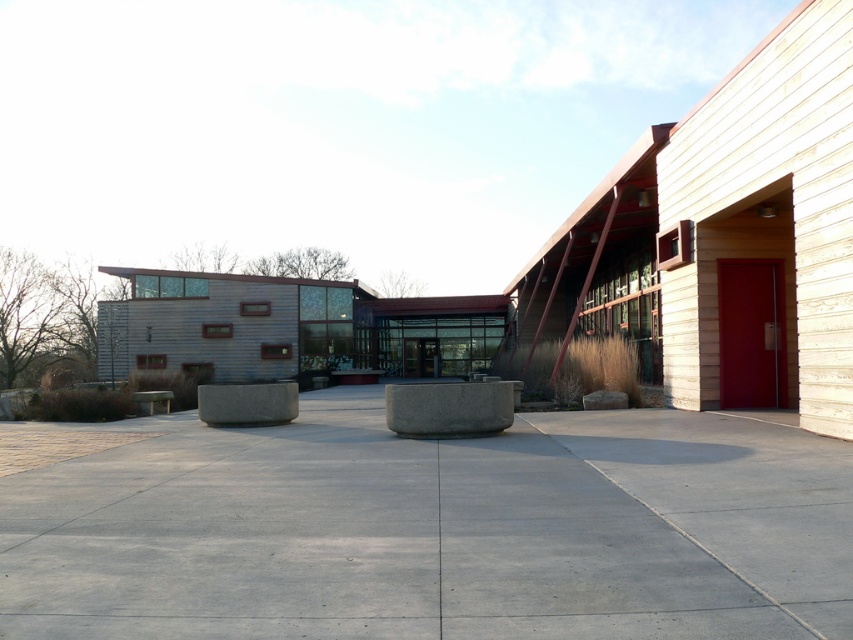
Question: In this image, where is gray concrete pavement at center located relative to gray concrete planter at center?

Choices:
 (A) right
 (B) left

Answer: (B)

Question: Based on their relative distances, which object is farther from the gray concrete at center?

Choices:
 (A) gray concrete planter at center
 (B) gray concrete pavement at center

Answer: (A)

Question: Is gray concrete pavement at center below gray concrete planter at center?

Choices:
 (A) no
 (B) yes

Answer: (B)

Question: Is gray concrete pavement at center positioned behind gray concrete planter at center?

Choices:
 (A) no
 (B) yes

Answer: (A)

Question: Which of the following is the closest to the observer?

Choices:
 (A) gray concrete at center
 (B) gray concrete planter at center

Answer: (B)

Question: Among these points, which one is farthest from the camera?

Choices:
 (A) (292, 388)
 (B) (433, 404)

Answer: (A)